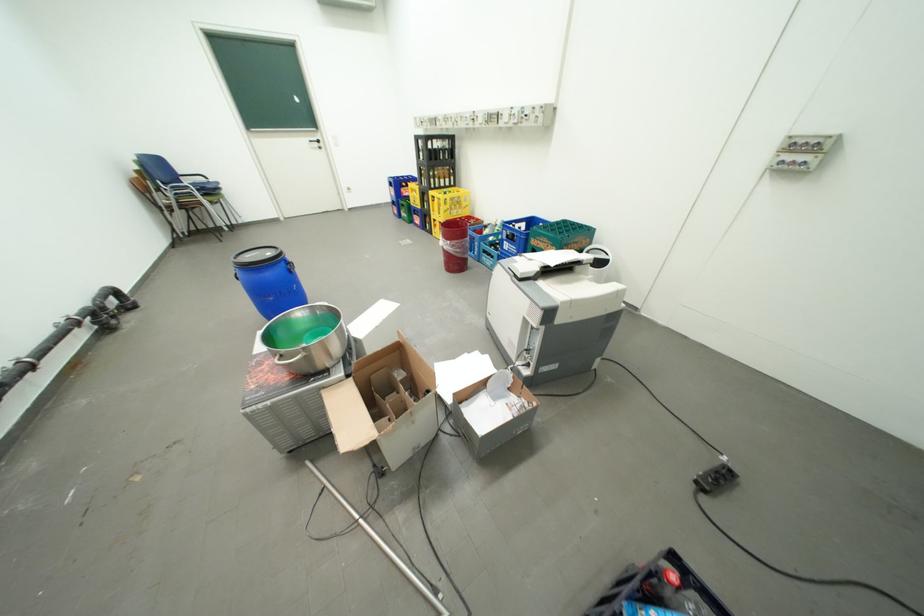
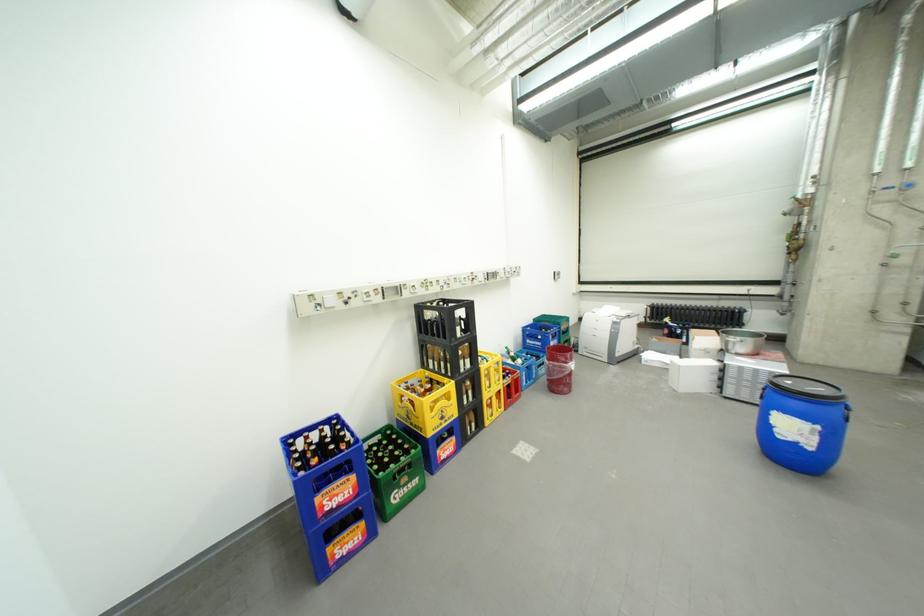
The point at (516, 244) is marked in the first image. Where is the corresponding point in the second image?

(562, 344)